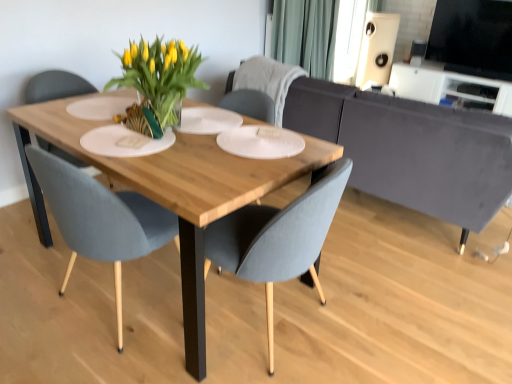
Locate an element on the screen. vacant area that lies to the right of natural wood table at center is located at coordinates pos(392,297).